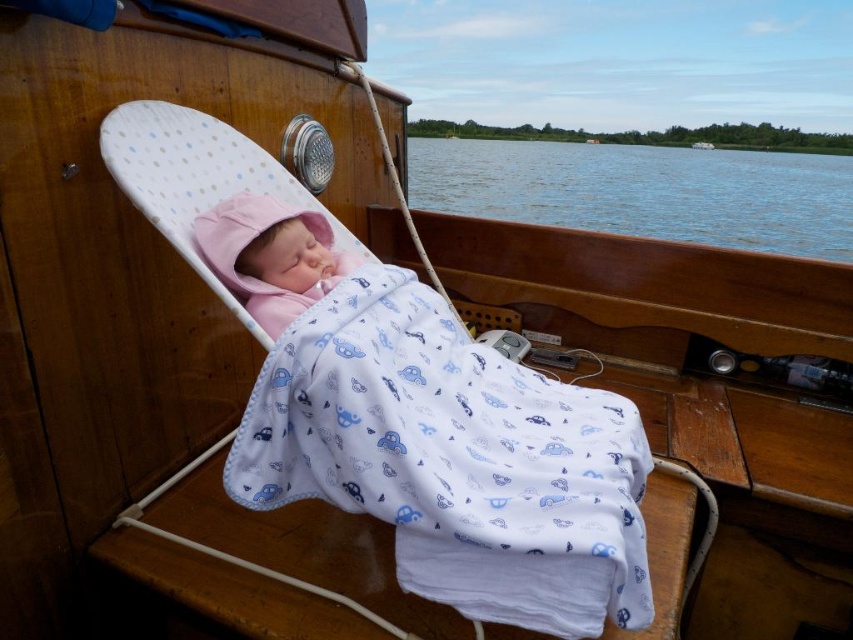
In the scene shown: Does pink fleece baby at center have a larger size compared to wooden boat at center?

Indeed, pink fleece baby at center has a larger size compared to wooden boat at center.

Find the location of a particular element. pink fleece baby at center is located at coordinates (270, 257).

Can you confirm if white cotton blanket at center is bigger than blue water at center?

No.

Measure the distance between white cotton blanket at center and camera.

The distance of white cotton blanket at center from camera is 1.11 meters.

The image size is (853, 640). Find the location of `white cotton blanket at center`. white cotton blanket at center is located at coordinates (453, 460).

Between blue water at center and wooden boat at center, which one appears on the left side from the viewer's perspective?

Positioned to the left is blue water at center.

Can you confirm if blue water at center is taller than wooden boat at center?

Indeed, blue water at center has a greater height compared to wooden boat at center.

What do you see at coordinates (643, 192) in the screenshot? Image resolution: width=853 pixels, height=640 pixels. I see `blue water at center` at bounding box center [643, 192].

Identify the location of blue water at center. The height and width of the screenshot is (640, 853). (643, 192).